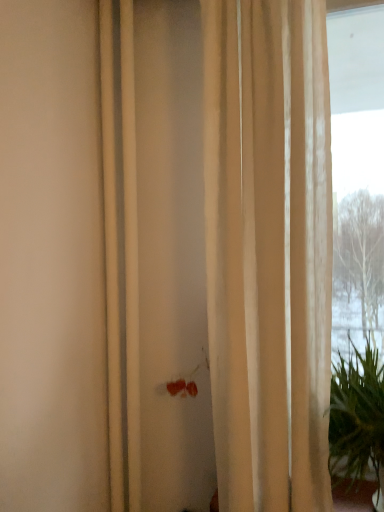
Question: Looking at their shapes, would you say green leafy plant at right is wider or thinner than beige sheer curtain at center?

Choices:
 (A) wide
 (B) thin

Answer: (A)

Question: From their relative heights in the image, would you say green leafy plant at right is taller or shorter than beige sheer curtain at center?

Choices:
 (A) tall
 (B) short

Answer: (B)

Question: From a real-world perspective, is green leafy plant at right above or below beige sheer curtain at center?

Choices:
 (A) below
 (B) above

Answer: (A)

Question: In terms of width, does beige sheer curtain at center look wider or thinner when compared to green leafy plant at right?

Choices:
 (A) thin
 (B) wide

Answer: (A)

Question: From a real-world perspective, is beige sheer curtain at center above or below green leafy plant at right?

Choices:
 (A) below
 (B) above

Answer: (B)

Question: Is point (236, 492) positioned closer to the camera than point (382, 473)?

Choices:
 (A) closer
 (B) farther

Answer: (A)

Question: In the image, is beige sheer curtain at center positioned in front of or behind green leafy plant at right?

Choices:
 (A) behind
 (B) front

Answer: (A)